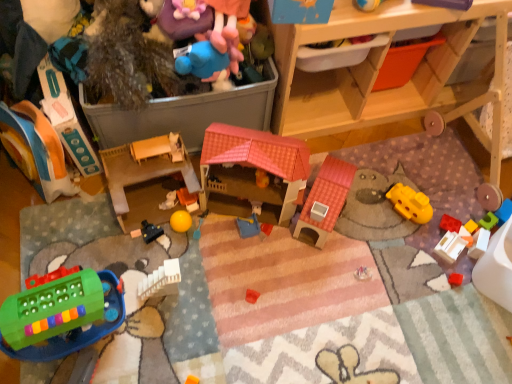
Question: Is white matte block at lower right, positioned as the second toy in right-to-left order, inside or outside of matte plastic toy at left, which is counted as the 12th toy, starting from the right?

Choices:
 (A) outside
 (B) inside

Answer: (A)

Question: Considering the positions of point (472, 248) and point (58, 77), is point (472, 248) closer or farther from the camera than point (58, 77)?

Choices:
 (A) closer
 (B) farther

Answer: (B)

Question: Which object is positioned farthest from the matte plastic toy at left, the second toy viewed from the left?

Choices:
 (A) smooth plastic toy at center, arranged as the 5th toy when viewed from the left
 (B) white matte block at lower right, which is the 12th toy in left-to-right order
 (C) yellow rubber ball at center, arranged as the 8th toy when viewed from the right
 (D) translucent plastic cube at center, which is counted as the 13th toy, starting from the left
 (E) wooden cabinet at upper right

Answer: (D)

Question: Estimate the real-world distances between objects in this image. Which object is closer to the yellow rubber ball at center, the 6th toy from the left?

Choices:
 (A) white plastic toy at lower right, which is counted as the tenth toy, starting from the left
 (B) blue plush toy at upper center, which is the eighth toy in left-to-right order
 (C) smooth orange ball at center, which is the seventh toy in right-to-left order
 (D) wooden cabinet at upper right
 (E) white matte block at lower right, which is the 12th toy in left-to-right order

Answer: (C)